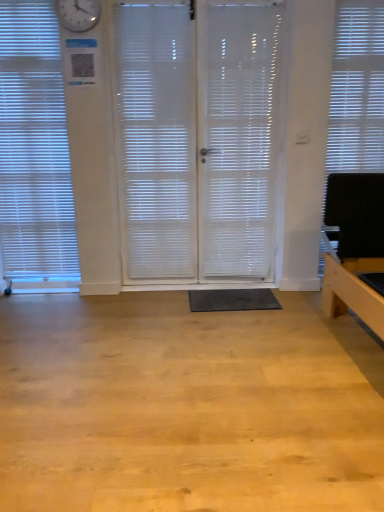
What do you see at coordinates (232, 300) in the screenshot? The width and height of the screenshot is (384, 512). I see `black rubber mat at center` at bounding box center [232, 300].

In order to face white frosted glass shutter at center, should I rotate leftwards or rightwards?

Answer: It's best to rotate left around 4.838 degrees.

Locate an element on the screen. white matte window blind at right, which is counted as the second window blind, starting from the left is located at coordinates (357, 90).

Measure the distance between white translucent screen door at center, the 1th screen door viewed from the right, and camera.

white translucent screen door at center, the 1th screen door viewed from the right, and camera are 8.83 feet apart.

Measure the distance between transparent plastic screen door at center, the 1th screen door positioned from the left, and camera.

The depth of transparent plastic screen door at center, the 1th screen door positioned from the left, is 8.75 feet.

Measure the distance between white translucent blinds at left, the first window blind in the left-to-right sequence, and camera.

white translucent blinds at left, the first window blind in the left-to-right sequence, and camera are 8.69 feet apart.

Image resolution: width=384 pixels, height=512 pixels. What are the coordinates of `black rubber mat at center` in the screenshot? It's located at (232, 300).

Which object is more forward, transparent plastic screen door at center, the 2th screen door from the right, or white translucent screen door at center, the 1th screen door viewed from the right?

Positioned in front is white translucent screen door at center, the 1th screen door viewed from the right.

Who is shorter, transparent plastic screen door at center, the 2th screen door from the right, or white translucent screen door at center, the 1th screen door viewed from the right?

Standing shorter between the two is white translucent screen door at center, the 1th screen door viewed from the right.

Is transparent plastic screen door at center, the 2th screen door from the right, looking in the opposite direction of white translucent screen door at center, arranged as the 2th screen door when viewed from the left?

Yes, transparent plastic screen door at center, the 2th screen door from the right, is positioned with its back facing white translucent screen door at center, arranged as the 2th screen door when viewed from the left.

Does transparent plastic screen door at center, the 2th screen door from the right, have a greater width compared to white translucent screen door at center, arranged as the 2th screen door when viewed from the left?

No, transparent plastic screen door at center, the 2th screen door from the right, is not wider than white translucent screen door at center, arranged as the 2th screen door when viewed from the left.

Can you tell me how much white translucent screen door at center, arranged as the 2th screen door when viewed from the left, and transparent plastic screen door at center, the 2th screen door from the right, differ in facing direction?

0.00352 degrees separate the facing orientations of white translucent screen door at center, arranged as the 2th screen door when viewed from the left, and transparent plastic screen door at center, the 2th screen door from the right.

Consider the image. From the image's perspective, is white translucent screen door at center, the 1th screen door viewed from the right, above or below transparent plastic screen door at center, the 1th screen door positioned from the left?

white translucent screen door at center, the 1th screen door viewed from the right, is below transparent plastic screen door at center, the 1th screen door positioned from the left.

Is white translucent screen door at center, arranged as the 2th screen door when viewed from the left, not near transparent plastic screen door at center, the 2th screen door from the right?

No, white translucent screen door at center, arranged as the 2th screen door when viewed from the left, is in close proximity to transparent plastic screen door at center, the 2th screen door from the right.

Considering the relative positions of white translucent screen door at center, arranged as the 2th screen door when viewed from the left, and transparent plastic screen door at center, the 2th screen door from the right, in the image provided, is white translucent screen door at center, arranged as the 2th screen door when viewed from the left, in front of transparent plastic screen door at center, the 2th screen door from the right,?

Yes, white translucent screen door at center, arranged as the 2th screen door when viewed from the left, is in front of transparent plastic screen door at center, the 2th screen door from the right.

Is white translucent screen door at center, the 1th screen door viewed from the right, located outside white translucent blinds at left, the 2th window blind viewed from the right?

white translucent screen door at center, the 1th screen door viewed from the right, is positioned outside white translucent blinds at left, the 2th window blind viewed from the right.

From the image's perspective, which screen door is the 2nd one below the white translucent blinds at left, the 2th window blind viewed from the right? Please provide its 2D coordinates.

[(238, 137)]

Which object is further away from the camera, white translucent screen door at center, the 1th screen door viewed from the right, or white translucent blinds at left, the first window blind in the left-to-right sequence?

white translucent screen door at center, the 1th screen door viewed from the right, is further from the camera.

From a real-world perspective, which object rests below the other?

From a 3D spatial view, white translucent screen door at center, arranged as the 2th screen door when viewed from the left, is below.

In the image, is transparent plastic screen door at center, the 2th screen door from the right, positioned in front of or behind white translucent blinds at left, the 2th window blind viewed from the right?

In the image, transparent plastic screen door at center, the 2th screen door from the right, appears behind white translucent blinds at left, the 2th window blind viewed from the right.

Would you say transparent plastic screen door at center, the 1th screen door positioned from the left, is a long distance from white translucent blinds at left, the first window blind in the left-to-right sequence?

No, transparent plastic screen door at center, the 1th screen door positioned from the left, is not far from white translucent blinds at left, the first window blind in the left-to-right sequence.

Would you say transparent plastic screen door at center, the 2th screen door from the right, is to the left or to the right of white translucent blinds at left, the 2th window blind viewed from the right, in the picture?

From the image, it's evident that transparent plastic screen door at center, the 2th screen door from the right, is to the right of white translucent blinds at left, the 2th window blind viewed from the right.

Is point (211, 147) closer or farther from the camera than point (364, 47)?

Point (211, 147).

Based on their sizes in the image, would you say white translucent screen door at center, the 1th screen door viewed from the right, is bigger or smaller than white matte window blind at right, which is the first window blind in right-to-left order?

Clearly, white translucent screen door at center, the 1th screen door viewed from the right, is larger in size than white matte window blind at right, which is the first window blind in right-to-left order.

Is white translucent screen door at center, arranged as the 2th screen door when viewed from the left, in contact with white matte window blind at right, which is the first window blind in right-to-left order?

There is a gap between white translucent screen door at center, arranged as the 2th screen door when viewed from the left, and white matte window blind at right, which is the first window blind in right-to-left order.

Is white matte window blind at right, which is the first window blind in right-to-left order, completely or partially inside white translucent screen door at center, arranged as the 2th screen door when viewed from the left?

No, white matte window blind at right, which is the first window blind in right-to-left order, is not a part of white translucent screen door at center, arranged as the 2th screen door when viewed from the left.

Could you tell me if transparent plastic screen door at center, the 1th screen door positioned from the left, is turned towards black rubber mat at center?

Yes.

Looking at this image, between transparent plastic screen door at center, the 1th screen door positioned from the left, and black rubber mat at center, which one appears on the right side from the viewer's perspective?

black rubber mat at center is more to the right.

Is black rubber mat at center completely or partially inside transparent plastic screen door at center, the 2th screen door from the right?

No.

From the picture: Considering the relative positions of transparent plastic screen door at center, the 2th screen door from the right, and black rubber mat at center in the image provided, is transparent plastic screen door at center, the 2th screen door from the right, behind black rubber mat at center?

No, it is not.

Would you say white translucent screen door at center, arranged as the 2th screen door when viewed from the left, is outside white frosted glass shutter at center?

white translucent screen door at center, arranged as the 2th screen door when viewed from the left, lies outside white frosted glass shutter at center's area.

From the image's perspective, is white translucent screen door at center, the 1th screen door viewed from the right, positioned above or below white frosted glass shutter at center?

white translucent screen door at center, the 1th screen door viewed from the right, is situated lower than white frosted glass shutter at center in the image.

From a real-world perspective, starting from the white frosted glass shutter at center, which screen door is the 2nd one below it? Please provide its 2D coordinates.

[(238, 137)]

Locate an element on the screen. The image size is (384, 512). screen door on the right of transparent plastic screen door at center, the 2th screen door from the right is located at coordinates (238, 137).

At what (x,y) coordinates should I click in order to perform the action: click on screen door on the left of white translucent screen door at center, the 1th screen door viewed from the right. Please return your answer as a coordinate pair (x, y). Looking at the image, I should click on (200, 138).

Estimate the real-world distances between objects in this image. Which object is further from white translucent screen door at center, arranged as the 2th screen door when viewed from the left, white matte window blind at right, which is the first window blind in right-to-left order, or white frosted glass shutter at center?

white matte window blind at right, which is the first window blind in right-to-left order.

From the image, which object appears to be farther from white translucent screen door at center, arranged as the 2th screen door when viewed from the left, white matte window blind at right, which is the first window blind in right-to-left order, or white translucent blinds at left, the 2th window blind viewed from the right?

white translucent blinds at left, the 2th window blind viewed from the right, is positioned further to the anchor white translucent screen door at center, arranged as the 2th screen door when viewed from the left.

Considering their positions, is white translucent screen door at center, the 1th screen door viewed from the right, positioned closer to black rubber mat at center than white translucent blinds at left, the 2th window blind viewed from the right?

white translucent screen door at center, the 1th screen door viewed from the right, is positioned closer to the anchor black rubber mat at center.

Which object lies nearer to the anchor point white translucent screen door at center, the 1th screen door viewed from the right, white matte window blind at right, which is counted as the second window blind, starting from the left, or transparent plastic screen door at center, the 2th screen door from the right?

transparent plastic screen door at center, the 2th screen door from the right, is closer to white translucent screen door at center, the 1th screen door viewed from the right.

Which object lies further to the anchor point white translucent screen door at center, arranged as the 2th screen door when viewed from the left, white frosted glass shutter at center or white translucent blinds at left, the 2th window blind viewed from the right?

Based on the image, white translucent blinds at left, the 2th window blind viewed from the right, appears to be further to white translucent screen door at center, arranged as the 2th screen door when viewed from the left.

Considering their positions, is white frosted glass shutter at center positioned further to white translucent blinds at left, the first window blind in the left-to-right sequence, than transparent plastic screen door at center, the 2th screen door from the right?

transparent plastic screen door at center, the 2th screen door from the right, is further to white translucent blinds at left, the first window blind in the left-to-right sequence.

When comparing their distances from white matte window blind at right, which is the first window blind in right-to-left order, does black rubber mat at center or white frosted glass shutter at center seem closer?

white frosted glass shutter at center lies closer to white matte window blind at right, which is the first window blind in right-to-left order, than the other object.

Looking at the image, which one is located closer to white frosted glass shutter at center, white translucent blinds at left, the first window blind in the left-to-right sequence, or black rubber mat at center?

Among the two, white translucent blinds at left, the first window blind in the left-to-right sequence, is located nearer to white frosted glass shutter at center.

At what (x,y) coordinates should I click in order to perform the action: click on shutter situated between white translucent blinds at left, the 2th window blind viewed from the right, and black rubber mat at center from left to right. Please return your answer as a coordinate pair (x, y). Looking at the image, I should click on (156, 139).

Where is `screen door between white translucent blinds at left, the first window blind in the left-to-right sequence, and black rubber mat at center from left to right`? screen door between white translucent blinds at left, the first window blind in the left-to-right sequence, and black rubber mat at center from left to right is located at coordinates (200, 138).

Find the location of a particular element. flat between white frosted glass shutter at center and white matte window blind at right, which is counted as the second window blind, starting from the left is located at coordinates (232, 300).

Identify the location of screen door between white frosted glass shutter at center and white translucent screen door at center, the 1th screen door viewed from the right. (200, 138).